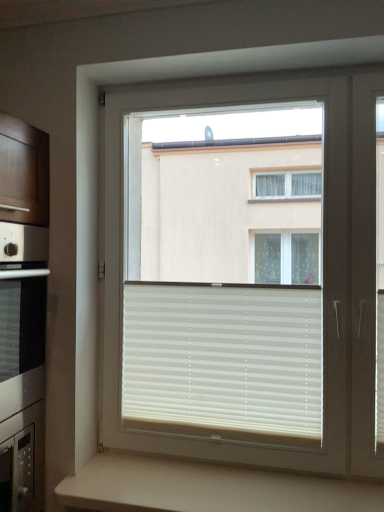
Question: Considering the positions of white matte blinds at center and beige matte counter at lower center in the image, is white matte blinds at center wider or thinner than beige matte counter at lower center?

Choices:
 (A) thin
 (B) wide

Answer: (A)

Question: Is white matte blinds at center inside or outside of beige matte counter at lower center?

Choices:
 (A) outside
 (B) inside

Answer: (A)

Question: Which is farther from the beige matte counter at lower center?

Choices:
 (A) white matte blinds at center
 (B) white plastic window at center

Answer: (B)

Question: Which object is the farthest from the beige matte counter at lower center?

Choices:
 (A) white matte blinds at center
 (B) white plastic window at center

Answer: (B)